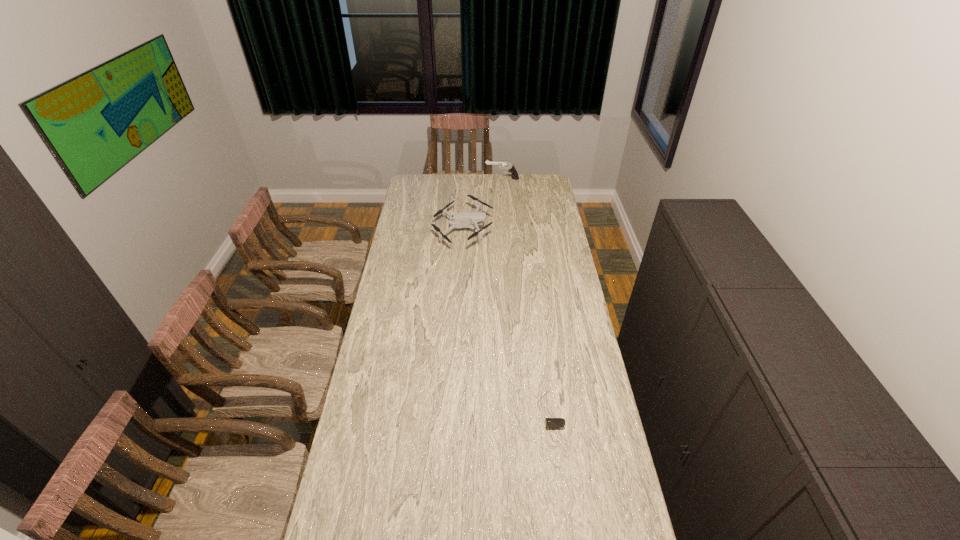
At what (x,y) coordinates should I click in order to perform the action: click on vacant space that is in between the gun and the webcam. Please return your answer as a coordinate pair (x, y). This screenshot has height=540, width=960. Looking at the image, I should click on (525, 291).

At what (x,y) coordinates should I click in order to perform the action: click on object that is the closest one to the nearest object. Please return your answer as a coordinate pair (x, y). The height and width of the screenshot is (540, 960). Looking at the image, I should click on (472, 219).

Locate which object ranks in proximity to the nearest object. Please provide its 2D coordinates. Your answer should be formatted as a tuple, i.e. [(x, y)], where the tuple contains the x and y coordinates of a point satisfying the conditions above.

[(472, 219)]